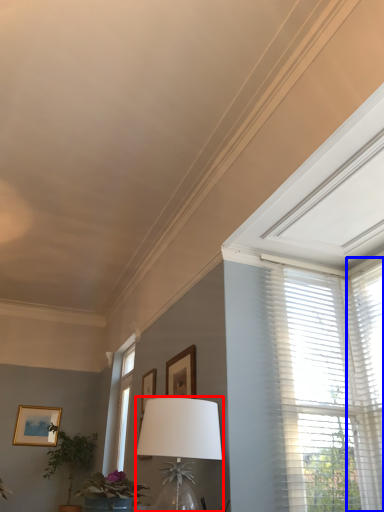
Question: Which of the following is the closest to the observer, table lamp (highlighted by a red box) or window blind (highlighted by a blue box)?

Choices:
 (A) table lamp
 (B) window blind

Answer: (A)